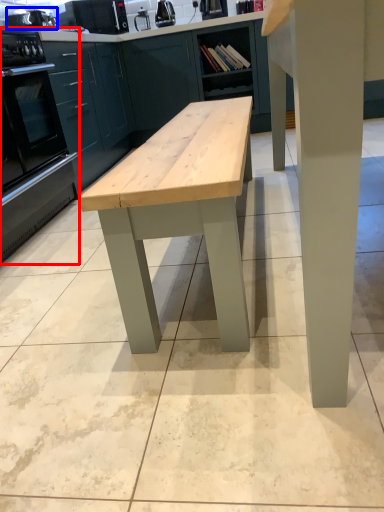
Question: Among these objects, which one is farthest to the camera, oven (highlighted by a red box) or appliance (highlighted by a blue box)?

Choices:
 (A) oven
 (B) appliance

Answer: (B)